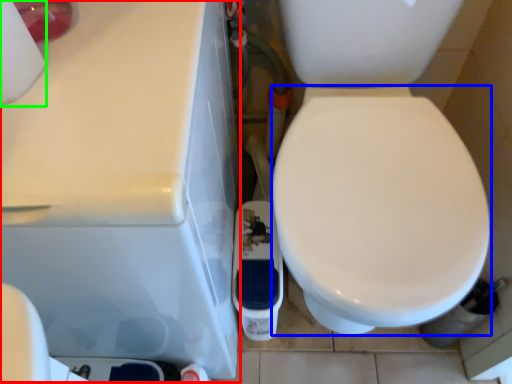
Question: Estimate the real-world distances between objects in this image. Which object is closer to porcelain (highlighted by a red box), bidet (highlighted by a blue box) or toilet paper (highlighted by a green box)?

Choices:
 (A) bidet
 (B) toilet paper

Answer: (B)